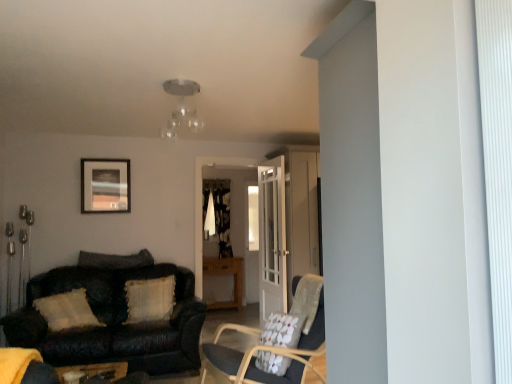
Question: Considering the positions of clear glass light fixture at upper center and matte black picture frame at upper left in the image, is clear glass light fixture at upper center taller or shorter than matte black picture frame at upper left?

Choices:
 (A) short
 (B) tall

Answer: (A)

Question: Considering the relative positions of clear glass light fixture at upper center and matte black picture frame at upper left in the image provided, is clear glass light fixture at upper center to the left or to the right of matte black picture frame at upper left?

Choices:
 (A) left
 (B) right

Answer: (B)

Question: Estimate the real-world distances between objects in this image. Which object is closer to the textured beige pillow at center left, which ranks as the 2th pillow in back-to-front order?

Choices:
 (A) velvet dark gray pillow at left, the third pillow when ordered from right to left
 (B) floral fabric chair at center
 (C) matte black picture frame at upper left
 (D) wooden side table at lower left
 (E) clear glass light fixture at upper center

Answer: (A)

Question: Which object is the farthest from the matte black picture frame at upper left?

Choices:
 (A) textured beige pillow at center left, the second pillow positioned from the front
 (B) wooden side table at lower left
 (C) white textured pillow at lower right, placed as the first pillow when sorted from right to left
 (D) white glass door at center
 (E) leather couch at left

Answer: (C)